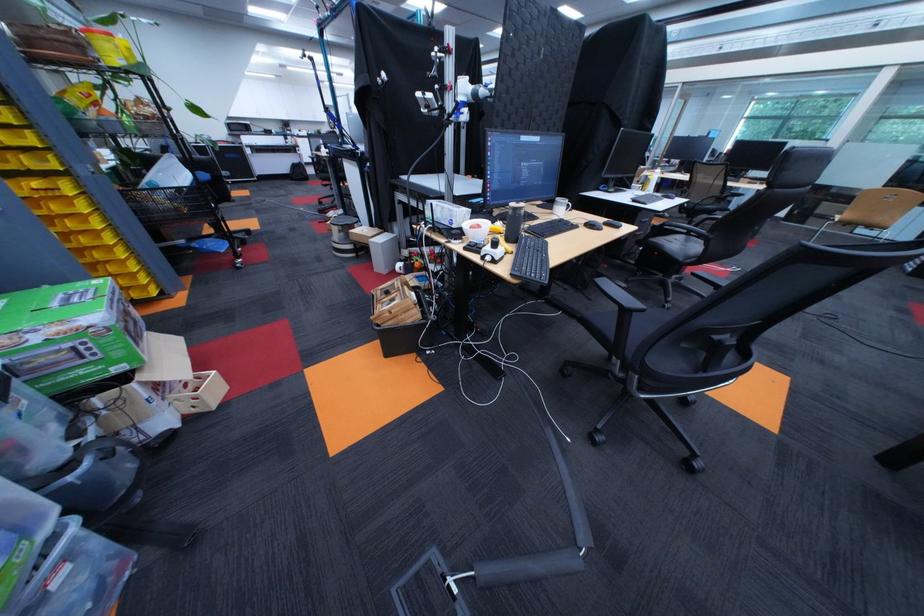
Find where to pull the shopping cart handle. Please return your answer as a coordinate pair (x, y).

(209, 254)